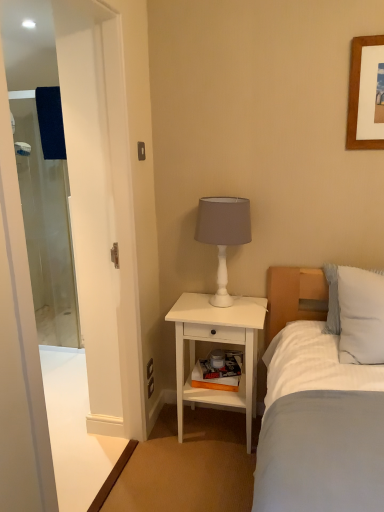
Identify the location of empty space that is ontop of white matte nightstand at center (from a real-world perspective). (216, 307).